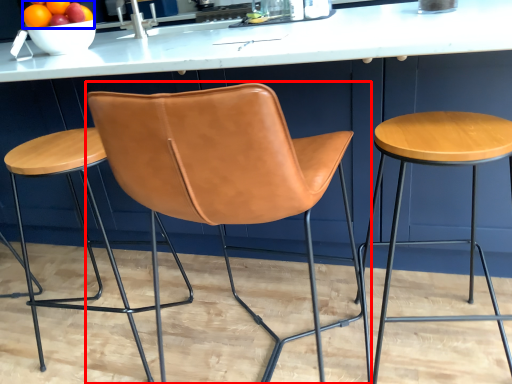
Question: Among these objects, which one is farthest to the camera, chair (highlighted by a red box) or fruit (highlighted by a blue box)?

Choices:
 (A) chair
 (B) fruit

Answer: (B)